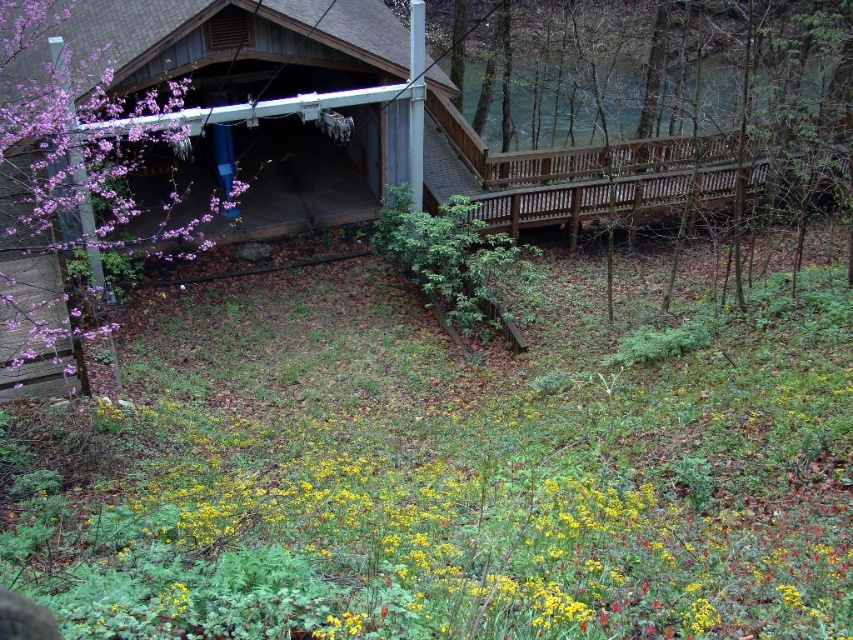
I want to click on wooden cabin at upper left, so click(x=204, y=106).

Does wooden cabin at upper left have a lesser width compared to pink blossoms at left?

No, wooden cabin at upper left is not thinner than pink blossoms at left.

Which is behind, point (97, 163) or point (57, 328)?

Point (97, 163)

The image size is (853, 640). I want to click on wooden cabin at upper left, so click(x=204, y=106).

Can you confirm if wooden cabin at upper left is positioned to the left of brown wooden porch at right?

Correct, you'll find wooden cabin at upper left to the left of brown wooden porch at right.

Which is behind, point (323, 83) or point (515, 164)?

Positioned behind is point (323, 83).

Between point (51, 36) and point (628, 179), which one is positioned behind?

Positioned behind is point (628, 179).

At what (x,y) coordinates should I click in order to perform the action: click on wooden cabin at upper left. Please return your answer as a coordinate pair (x, y). Looking at the image, I should click on (204, 106).

Is pink blossoms at left shorter than brown wooden porch at right?

In fact, pink blossoms at left may be taller than brown wooden porch at right.

Can you confirm if pink blossoms at left is thinner than brown wooden porch at right?

Correct, pink blossoms at left's width is less than brown wooden porch at right's.

The height and width of the screenshot is (640, 853). What do you see at coordinates (67, 173) in the screenshot? I see `pink blossoms at left` at bounding box center [67, 173].

At what (x,y) coordinates should I click in order to perform the action: click on pink blossoms at left. Please return your answer as a coordinate pair (x, y). The image size is (853, 640). Looking at the image, I should click on (67, 173).